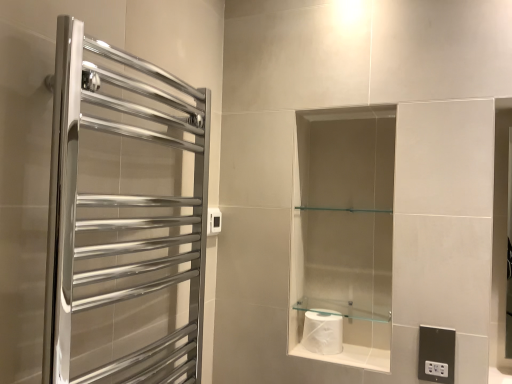
This screenshot has width=512, height=384. What do you see at coordinates (124, 218) in the screenshot? I see `polished chrome towel rack at left` at bounding box center [124, 218].

This screenshot has height=384, width=512. What do you see at coordinates (323, 331) in the screenshot?
I see `white glossy toilet paper at center` at bounding box center [323, 331].

What is the approximate width of black plastic electrical outlet at lower right, the 1th electric outlet in the bottom-to-top sequence?

black plastic electrical outlet at lower right, the 1th electric outlet in the bottom-to-top sequence, is 1.51 centimeters wide.

The image size is (512, 384). What do you see at coordinates (347, 333) in the screenshot?
I see `white glossy toilet paper at lower center` at bounding box center [347, 333].

What is the approximate height of white glossy toilet paper at lower center?

It is 4.44 centimeters.

This screenshot has height=384, width=512. Find the location of `white plastic electric outlet at upper center, marked as the first electric outlet in a back-to-front arrangement`. white plastic electric outlet at upper center, marked as the first electric outlet in a back-to-front arrangement is located at coordinates (214, 221).

What do you see at coordinates (214, 221) in the screenshot?
I see `white plastic electric outlet at upper center, positioned as the 1th electric outlet in top-to-bottom order` at bounding box center [214, 221].

This screenshot has height=384, width=512. In order to click on polished chrome towel rack at left in this screenshot , I will do `click(124, 218)`.

From the image's perspective, does polished chrome towel rack at left appear higher than white glossy toilet paper at lower center?

Yes, from the image's perspective, polished chrome towel rack at left is over white glossy toilet paper at lower center.

From a real-world perspective, is polished chrome towel rack at left above or below white glossy toilet paper at lower center?

polished chrome towel rack at left is above white glossy toilet paper at lower center.

Which object is positioned more to the left, polished chrome towel rack at left or white glossy toilet paper at lower center?

From the viewer's perspective, polished chrome towel rack at left appears more on the left side.

Considering the sizes of objects polished chrome towel rack at left and white glossy toilet paper at lower center in the image provided, who is shorter, polished chrome towel rack at left or white glossy toilet paper at lower center?

Standing shorter between the two is white glossy toilet paper at lower center.

Consider the image. Is polished chrome towel rack at left next to white glossy toilet paper at center and touching it?

They are not placed beside each other.

How different are the orientations of polished chrome towel rack at left and white glossy toilet paper at center in degrees?

The facing directions of polished chrome towel rack at left and white glossy toilet paper at center are 88.9 degrees apart.

Consider the image. From a real-world perspective, is polished chrome towel rack at left located higher than white glossy toilet paper at center?

Yes.

From the image's perspective, is polished chrome towel rack at left located above white glossy toilet paper at center?

Correct, polished chrome towel rack at left appears higher than white glossy toilet paper at center in the image.

How many degrees apart are the facing directions of white glossy toilet paper at center and white plastic electric outlet at upper center, placed as the 2th electric outlet when sorted from front to back?

The angular difference between white glossy toilet paper at center and white plastic electric outlet at upper center, placed as the 2th electric outlet when sorted from front to back, is 86.7 degrees.

Where is `toilet paper that appears on the right of white plastic electric outlet at upper center, which appears as the first electric outlet when viewed from the left`? toilet paper that appears on the right of white plastic electric outlet at upper center, which appears as the first electric outlet when viewed from the left is located at coordinates (323, 331).

Which is in front, point (317, 324) or point (211, 210)?

The point (317, 324) is closer to the camera.

Could you tell me if white glossy toilet paper at center is turned towards white plastic electric outlet at upper center, positioned as the 1th electric outlet in top-to-bottom order?

No, white glossy toilet paper at center is not aimed at white plastic electric outlet at upper center, positioned as the 1th electric outlet in top-to-bottom order.

Considering their positions, is clear glass shelf at center located in front of or behind white glossy toilet paper at center?

Visually, clear glass shelf at center is located in front of white glossy toilet paper at center.

From a real-world perspective, relative to white glossy toilet paper at center, is clear glass shelf at center vertically above or below?

In terms of real-world spatial position, clear glass shelf at center is above white glossy toilet paper at center.

Is clear glass shelf at center positioned with its back to white glossy toilet paper at center?

clear glass shelf at center does not have its back to white glossy toilet paper at center.

Which of these two, clear glass shelf at center or white glossy toilet paper at center, is wider?

With larger width is white glossy toilet paper at center.

Identify the location of electric outlet on the right of white glossy toilet paper at center. The height and width of the screenshot is (384, 512). (436, 354).

Is black plastic electrical outlet at lower right, placed as the 2th electric outlet when sorted from back to front, surrounding white glossy toilet paper at center?

No, white glossy toilet paper at center is not surrounded by black plastic electrical outlet at lower right, placed as the 2th electric outlet when sorted from back to front.

Is black plastic electrical outlet at lower right, the second electric outlet in the top-to-bottom sequence, wider or thinner than white glossy toilet paper at center?

Clearly, black plastic electrical outlet at lower right, the second electric outlet in the top-to-bottom sequence, has less width compared to white glossy toilet paper at center.

Measure the distance from black plastic electrical outlet at lower right, the second electric outlet in the top-to-bottom sequence, to white glossy toilet paper at center.

The distance of black plastic electrical outlet at lower right, the second electric outlet in the top-to-bottom sequence, from white glossy toilet paper at center is 11.68 inches.

Is white glossy toilet paper at center inside the boundaries of clear glass shelf at center, or outside?

white glossy toilet paper at center is not inside clear glass shelf at center, it's outside.

In the scene shown: Considering the positions of objects white glossy toilet paper at center and clear glass shelf at center in the image provided, who is more to the left, white glossy toilet paper at center or clear glass shelf at center?

white glossy toilet paper at center.

From the image's perspective, is white glossy toilet paper at center located above or below clear glass shelf at center?

Based on their image positions, white glossy toilet paper at center is located beneath clear glass shelf at center.

Locate an element on the screen. Image resolution: width=512 pixels, height=384 pixels. balustrade above the white glossy toilet paper at center (from a real-world perspective) is located at coordinates click(x=345, y=309).

Based on the photo, how far apart are white glossy toilet paper at center and black plastic electrical outlet at lower right, which ranks as the 1th electric outlet in right-to-left order?

The distance of white glossy toilet paper at center from black plastic electrical outlet at lower right, which ranks as the 1th electric outlet in right-to-left order, is 11.68 inches.

From the image's perspective, between white glossy toilet paper at center and black plastic electrical outlet at lower right, placed as the 2th electric outlet when sorted from back to front, which one is located above?

white glossy toilet paper at center, from the image's perspective.

Is white glossy toilet paper at center surrounding black plastic electrical outlet at lower right, which ranks as the 1th electric outlet in right-to-left order?

Definitely not — black plastic electrical outlet at lower right, which ranks as the 1th electric outlet in right-to-left order, is not inside white glossy toilet paper at center.

Considering the relative sizes of white glossy toilet paper at center and black plastic electrical outlet at lower right, arranged as the 2th electric outlet when viewed from the left, in the image provided, is white glossy toilet paper at center smaller than black plastic electrical outlet at lower right, arranged as the 2th electric outlet when viewed from the left,?

Actually, white glossy toilet paper at center might be larger than black plastic electrical outlet at lower right, arranged as the 2th electric outlet when viewed from the left.

I want to click on screen door located above the white glossy toilet paper at lower center (from a real-world perspective), so click(x=124, y=218).

Where is `toilet paper on the right of polished chrome towel rack at left`? The image size is (512, 384). toilet paper on the right of polished chrome towel rack at left is located at coordinates (323, 331).

Which object lies further to the anchor point white glossy toilet paper at center, black plastic electrical outlet at lower right, positioned as the first electric outlet in front-to-back order, or polished chrome towel rack at left?

polished chrome towel rack at left is further to white glossy toilet paper at center.

Which object lies further to the anchor point black plastic electrical outlet at lower right, arranged as the 2th electric outlet when viewed from the left, polished chrome towel rack at left or white glossy toilet paper at center?

polished chrome towel rack at left.

Estimate the real-world distances between objects in this image. Which object is closer to clear glass shelf at center, polished chrome towel rack at left or white glossy toilet paper at lower center?

white glossy toilet paper at lower center.

Based on their spatial positions, is clear glass shelf at center or black plastic electrical outlet at lower right, placed as the 2th electric outlet when sorted from back to front, closer to white glossy toilet paper at center?

clear glass shelf at center is positioned closer to the anchor white glossy toilet paper at center.

From the image, which object appears to be farther from white glossy toilet paper at center, clear glass shelf at center or white glossy toilet paper at lower center?

clear glass shelf at center is further to white glossy toilet paper at center.

Considering their positions, is black plastic electrical outlet at lower right, the second electric outlet in the top-to-bottom sequence, positioned further to polished chrome towel rack at left than white plastic electric outlet at upper center, marked as the first electric outlet in a back-to-front arrangement?

black plastic electrical outlet at lower right, the second electric outlet in the top-to-bottom sequence, is positioned further to the anchor polished chrome towel rack at left.

Consider the image. When comparing their distances from white glossy toilet paper at center, does black plastic electrical outlet at lower right, arranged as the 2th electric outlet when viewed from the left, or white glossy toilet paper at lower center seem further?

black plastic electrical outlet at lower right, arranged as the 2th electric outlet when viewed from the left, is further to white glossy toilet paper at center.

Considering their positions, is polished chrome towel rack at left positioned further to white glossy toilet paper at lower center than black plastic electrical outlet at lower right, which ranks as the 1th electric outlet in right-to-left order?

polished chrome towel rack at left.

You are a GUI agent. You are given a task and a screenshot of the screen. Output one action in this format:
    pyautogui.click(x=<x>, y=<y>)
    Task: Click on the cabinet situated between white plastic electric outlet at upper center, positioned as the 1th electric outlet in top-to-bottom order, and black plastic electrical outlet at lower right, the second electric outlet in the top-to-bottom sequence, from left to right
    This screenshot has height=384, width=512.
    Given the screenshot: What is the action you would take?
    pyautogui.click(x=347, y=333)

The image size is (512, 384). I want to click on cabinet between polished chrome towel rack at left and white plastic electric outlet at upper center, the second electric outlet when ordered from bottom to top, from front to back, so click(347, 333).

This screenshot has width=512, height=384. I want to click on electric outlet located between polished chrome towel rack at left and black plastic electrical outlet at lower right, arranged as the 2th electric outlet when viewed from the left, in the left-right direction, so click(x=214, y=221).

At what (x,y) coordinates should I click in order to perform the action: click on balustrade between white glossy toilet paper at lower center and black plastic electrical outlet at lower right, the second electric outlet in the top-to-bottom sequence, from left to right. Please return your answer as a coordinate pair (x, y). The height and width of the screenshot is (384, 512). Looking at the image, I should click on (345, 309).